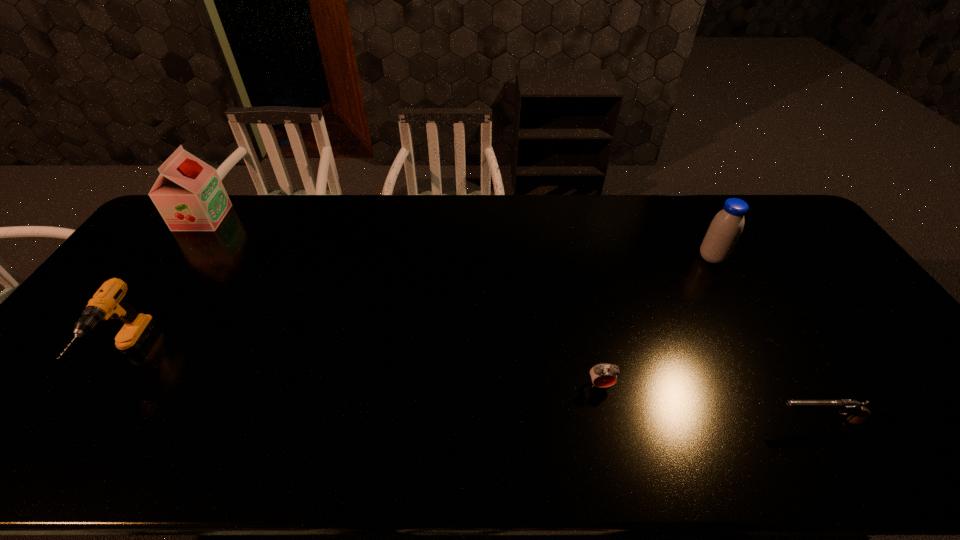
What are the coordinates of `free space between the drill and the third object from left to right` in the screenshot? It's located at click(x=365, y=370).

Image resolution: width=960 pixels, height=540 pixels. Find the location of `unoccupied position between the third object from right to left and the second farthest object`. unoccupied position between the third object from right to left and the second farthest object is located at coordinates (656, 321).

Select which object appears as the third closest to the alarm clock. Please provide its 2D coordinates. Your answer should be formatted as a tuple, i.e. [(x, y)], where the tuple contains the x and y coordinates of a point satisfying the conditions above.

[(107, 302)]

This screenshot has height=540, width=960. I want to click on the fourth closest object to the fourth nearest object, so click(x=189, y=195).

Where is `vacant region that satisfies the following two spatial constraints: 1. with the cap open on the shorter soya milk; 2. on the left side of the farthest object`? This screenshot has height=540, width=960. vacant region that satisfies the following two spatial constraints: 1. with the cap open on the shorter soya milk; 2. on the left side of the farthest object is located at coordinates (174, 258).